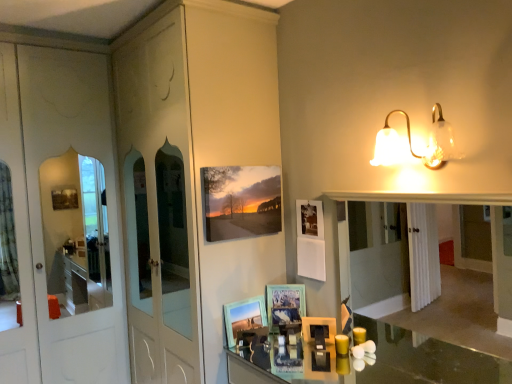
What do you see at coordinates (342, 344) in the screenshot? The width and height of the screenshot is (512, 384). I see `yellow wax candle at center` at bounding box center [342, 344].

Where is `yellow wax candle at center`? yellow wax candle at center is located at coordinates coord(342,344).

Locate an element on the screen. Image resolution: width=512 pixels, height=384 pixels. clear glass mirror at center is located at coordinates (425, 241).

The height and width of the screenshot is (384, 512). I want to click on wooden picture frame at center, the second picture frame when ordered from bottom to top, so pos(285,304).

The image size is (512, 384). What are the coordinates of `matte canvas print at upper center, which is counted as the first picture frame, starting from the top` in the screenshot? It's located at (241, 201).

The height and width of the screenshot is (384, 512). What do you see at coordinates (411, 143) in the screenshot?
I see `translucent glass sconce at upper right` at bounding box center [411, 143].

At what (x,y) coordinates should I click in order to perform the action: click on yellow wax candle at center. Please return your answer as a coordinate pair (x, y). The height and width of the screenshot is (384, 512). Looking at the image, I should click on (342, 344).

From the picture: Is wooden picture frame at center, the third picture frame in the top-to-bottom sequence, touching wooden picture frame at center, the 2th picture frame from the top?

No, wooden picture frame at center, the third picture frame in the top-to-bottom sequence, is not next to wooden picture frame at center, the 2th picture frame from the top.

Identify the location of picture frame that is on the right side of wooden picture frame at center, the third picture frame in the top-to-bottom sequence. (285, 304).

Is wooden picture frame at center, which appears as the 1th picture frame when ordered from the bottom, taller than wooden picture frame at center, the 2th picture frame from the top?

In fact, wooden picture frame at center, which appears as the 1th picture frame when ordered from the bottom, may be shorter than wooden picture frame at center, the 2th picture frame from the top.

Considering the relative sizes of wooden picture frame at center, the third picture frame in the top-to-bottom sequence, and wooden picture frame at center, the 2th picture frame from the top, in the image provided, is wooden picture frame at center, the third picture frame in the top-to-bottom sequence, wider than wooden picture frame at center, the 2th picture frame from the top,?

Yes, wooden picture frame at center, the third picture frame in the top-to-bottom sequence, is wider than wooden picture frame at center, the 2th picture frame from the top.

Can you confirm if translucent glass sconce at upper right is wider than matte canvas print at upper center, the third picture frame ordered from the bottom?

Indeed, translucent glass sconce at upper right has a greater width compared to matte canvas print at upper center, the third picture frame ordered from the bottom.

Based on the photo, considering the sizes of objects translucent glass sconce at upper right and matte canvas print at upper center, which is counted as the first picture frame, starting from the top, in the image provided, who is smaller, translucent glass sconce at upper right or matte canvas print at upper center, which is counted as the first picture frame, starting from the top,?

Smaller between the two is matte canvas print at upper center, which is counted as the first picture frame, starting from the top.

Looking at this image, which object is further away from the camera, translucent glass sconce at upper right or matte canvas print at upper center, the third picture frame ordered from the bottom?

matte canvas print at upper center, the third picture frame ordered from the bottom, is further away from the camera.

From a real-world perspective, is translucent glass sconce at upper right beneath matte canvas print at upper center, which is counted as the first picture frame, starting from the top?

Incorrect, from a real-world perspective, translucent glass sconce at upper right is higher than matte canvas print at upper center, which is counted as the first picture frame, starting from the top.

Considering the positions of objects clear glass mirror at center and wooden picture frame at center, the 2th picture frame from the top, in the image provided, who is more to the left, clear glass mirror at center or wooden picture frame at center, the 2th picture frame from the top,?

wooden picture frame at center, the 2th picture frame from the top.

From the picture: Which object is more forward, clear glass mirror at center or wooden picture frame at center, the second picture frame when ordered from bottom to top?

clear glass mirror at center.

Is clear glass mirror at center oriented away from wooden picture frame at center, the second picture frame when ordered from bottom to top?

clear glass mirror at center does not have its back to wooden picture frame at center, the second picture frame when ordered from bottom to top.

Is clear glass mirror at center bigger or smaller than wooden picture frame at center, the second picture frame when ordered from bottom to top?

clear glass mirror at center is bigger than wooden picture frame at center, the second picture frame when ordered from bottom to top.

This screenshot has height=384, width=512. What are the coordinates of `mirror that appears above the yellow wax candle at center (from the image's perspective)` in the screenshot? It's located at (425, 241).

From the image's perspective, relative to clear glass mirror at center, is yellow wax candle at center above or below?

From the image's perspective, yellow wax candle at center appears below clear glass mirror at center.

Considering the relative sizes of yellow wax candle at center and clear glass mirror at center in the image provided, is yellow wax candle at center bigger than clear glass mirror at center?

Incorrect, yellow wax candle at center is not larger than clear glass mirror at center.

Would you say wooden picture frame at center, the third picture frame in the top-to-bottom sequence, is inside or outside matte canvas print at upper center, the third picture frame ordered from the bottom?

wooden picture frame at center, the third picture frame in the top-to-bottom sequence, lies outside matte canvas print at upper center, the third picture frame ordered from the bottom.

Considering the positions of objects wooden picture frame at center, which appears as the 1th picture frame when ordered from the bottom, and matte canvas print at upper center, the third picture frame ordered from the bottom, in the image provided, who is in front, wooden picture frame at center, which appears as the 1th picture frame when ordered from the bottom, or matte canvas print at upper center, the third picture frame ordered from the bottom,?

matte canvas print at upper center, the third picture frame ordered from the bottom, is closer to the camera.

From the image's perspective, is wooden picture frame at center, which appears as the 1th picture frame when ordered from the bottom, located above or below matte canvas print at upper center, the third picture frame ordered from the bottom?

Clearly, from the image's perspective, wooden picture frame at center, which appears as the 1th picture frame when ordered from the bottom, is below matte canvas print at upper center, the third picture frame ordered from the bottom.

Considering the positions of objects wooden picture frame at center, which appears as the 1th picture frame when ordered from the bottom, and matte canvas print at upper center, the third picture frame ordered from the bottom, in the image provided, who is more to the left, wooden picture frame at center, which appears as the 1th picture frame when ordered from the bottom, or matte canvas print at upper center, the third picture frame ordered from the bottom,?

matte canvas print at upper center, the third picture frame ordered from the bottom.

Is yellow wax candle at center at the back of matte canvas print at upper center, which is counted as the first picture frame, starting from the top?

No, matte canvas print at upper center, which is counted as the first picture frame, starting from the top,'s orientation is not away from yellow wax candle at center.

Which object is positioned more to the right, matte canvas print at upper center, which is counted as the first picture frame, starting from the top, or yellow wax candle at center?

Positioned to the right is yellow wax candle at center.

Is matte canvas print at upper center, which is counted as the first picture frame, starting from the top, positioned behind yellow wax candle at center?

Yes, matte canvas print at upper center, which is counted as the first picture frame, starting from the top, is further from the camera.

Which object is positioned more to the right, matte canvas print at upper center, the third picture frame ordered from the bottom, or wooden picture frame at center, the third picture frame in the top-to-bottom sequence?

Positioned to the right is wooden picture frame at center, the third picture frame in the top-to-bottom sequence.

From the image's perspective, which one is positioned lower, matte canvas print at upper center, the third picture frame ordered from the bottom, or wooden picture frame at center, which appears as the 1th picture frame when ordered from the bottom?

wooden picture frame at center, which appears as the 1th picture frame when ordered from the bottom, is shown below in the image.

Is the depth of matte canvas print at upper center, which is counted as the first picture frame, starting from the top, less than that of wooden picture frame at center, which appears as the 1th picture frame when ordered from the bottom?

Yes, it is in front of wooden picture frame at center, which appears as the 1th picture frame when ordered from the bottom.

Is matte canvas print at upper center, the third picture frame ordered from the bottom, smaller than wooden picture frame at center, the third picture frame in the top-to-bottom sequence?

No, matte canvas print at upper center, the third picture frame ordered from the bottom, is not smaller than wooden picture frame at center, the third picture frame in the top-to-bottom sequence.

The width and height of the screenshot is (512, 384). In order to click on picture frame that is the 1st one above the wooden picture frame at center, which appears as the 1th picture frame when ordered from the bottom (from a real-world perspective) in this screenshot , I will do `click(285, 304)`.

From the image's perspective, which picture frame is the 1st one below the translucent glass sconce at upper right? Please provide its 2D coordinates.

[(241, 201)]

Estimate the real-world distances between objects in this image. Which object is further from wooden picture frame at center, the third picture frame in the top-to-bottom sequence, clear glass mirror at center or yellow wax candle at center?

Among the two, clear glass mirror at center is located further to wooden picture frame at center, the third picture frame in the top-to-bottom sequence.

Considering their positions, is matte canvas print at upper center, which is counted as the first picture frame, starting from the top, positioned closer to wooden picture frame at center, which appears as the 1th picture frame when ordered from the bottom, than translucent glass sconce at upper right?

matte canvas print at upper center, which is counted as the first picture frame, starting from the top, is closer to wooden picture frame at center, which appears as the 1th picture frame when ordered from the bottom.

Estimate the real-world distances between objects in this image. Which object is closer to matte canvas print at upper center, which is counted as the first picture frame, starting from the top, wooden picture frame at center, the third picture frame in the top-to-bottom sequence, or translucent glass sconce at upper right?

Among the two, wooden picture frame at center, the third picture frame in the top-to-bottom sequence, is located nearer to matte canvas print at upper center, which is counted as the first picture frame, starting from the top.

Looking at the image, which one is located closer to clear glass mirror at center, matte canvas print at upper center, the third picture frame ordered from the bottom, or translucent glass sconce at upper right?

Based on the image, matte canvas print at upper center, the third picture frame ordered from the bottom, appears to be nearer to clear glass mirror at center.

From the picture: Looking at the image, which one is located further to matte canvas print at upper center, the third picture frame ordered from the bottom, wooden picture frame at center, the 2th picture frame from the top, or yellow wax candle at center?

Among the two, yellow wax candle at center is located further to matte canvas print at upper center, the third picture frame ordered from the bottom.

From the image, which object appears to be farther from matte canvas print at upper center, the third picture frame ordered from the bottom, wooden picture frame at center, the 2th picture frame from the top, or translucent glass sconce at upper right?

Based on the image, translucent glass sconce at upper right appears to be further to matte canvas print at upper center, the third picture frame ordered from the bottom.

Looking at this image, estimate the real-world distances between objects in this image. Which object is closer to yellow wax candle at center, matte canvas print at upper center, which is counted as the first picture frame, starting from the top, or translucent glass sconce at upper right?

The object closer to yellow wax candle at center is matte canvas print at upper center, which is counted as the first picture frame, starting from the top.

Estimate the real-world distances between objects in this image. Which object is further from wooden picture frame at center, the second picture frame when ordered from bottom to top, yellow wax candle at center or clear glass mirror at center?

clear glass mirror at center.

Image resolution: width=512 pixels, height=384 pixels. Identify the location of light fixture located between matte canvas print at upper center, the third picture frame ordered from the bottom, and clear glass mirror at center in the left-right direction. (411, 143).

Where is `picture frame between wooden picture frame at center, which appears as the 1th picture frame when ordered from the bottom, and yellow wax candle at center`? picture frame between wooden picture frame at center, which appears as the 1th picture frame when ordered from the bottom, and yellow wax candle at center is located at coordinates (285, 304).

At what (x,y) coordinates should I click in order to perform the action: click on light fixture located between clear glass mirror at center and wooden picture frame at center, the second picture frame when ordered from bottom to top, in the depth direction. Please return your answer as a coordinate pair (x, y). The image size is (512, 384). Looking at the image, I should click on (411, 143).

At what (x,y) coordinates should I click in order to perform the action: click on candle between clear glass mirror at center and matte canvas print at upper center, which is counted as the first picture frame, starting from the top, along the z-axis. Please return your answer as a coordinate pair (x, y). This screenshot has width=512, height=384. Looking at the image, I should click on (342, 344).